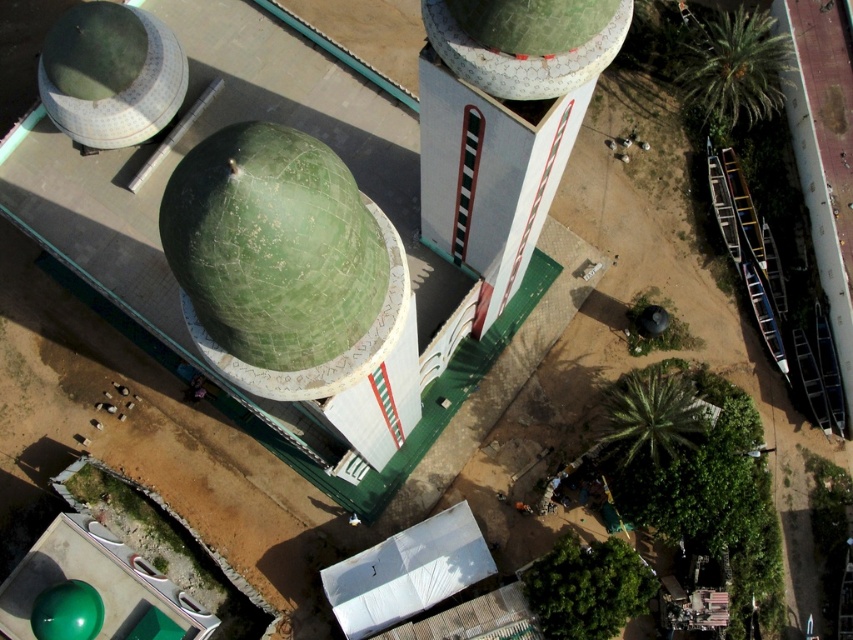
Question: Is green concrete tower at upper center wider than green matte dome at upper left?

Choices:
 (A) no
 (B) yes

Answer: (A)

Question: Which point is closer to the camera?

Choices:
 (A) (440, 12)
 (B) (155, 58)

Answer: (A)

Question: Is green concrete tower at upper center wider than green textured dome at upper center?

Choices:
 (A) yes
 (B) no

Answer: (A)

Question: Does green matte dome at center appear on the left side of green textured dome at upper center?

Choices:
 (A) yes
 (B) no

Answer: (A)

Question: Among these objects, which one is farthest from the camera?

Choices:
 (A) green concrete tower at upper center
 (B) green matte dome at upper left
 (C) green textured dome at upper center

Answer: (B)

Question: Which point is closer to the camera?

Choices:
 (A) green matte dome at center
 (B) green matte dome at upper left
 (C) green textured dome at upper center

Answer: (A)